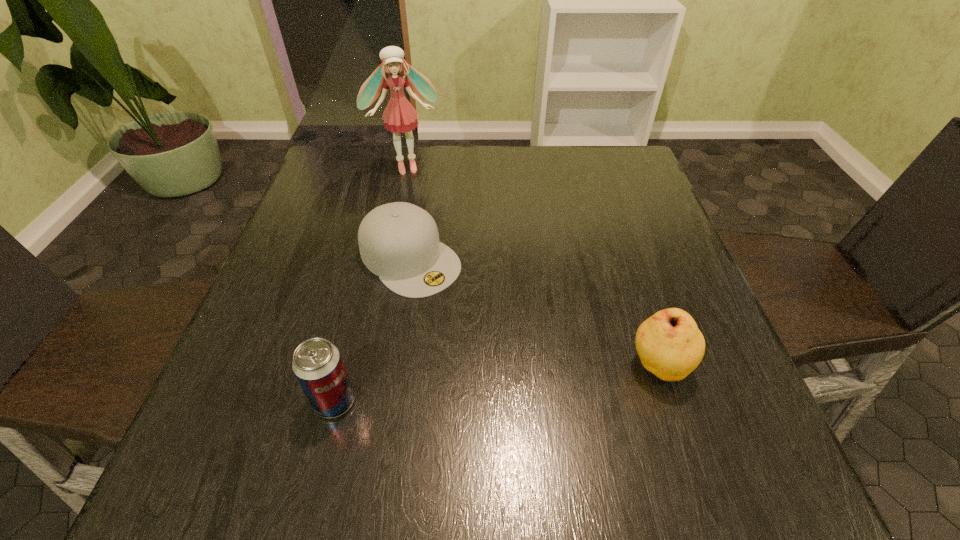
Where is `blank region between the rightmost object and the tallest object`? The image size is (960, 540). blank region between the rightmost object and the tallest object is located at coordinates (532, 267).

The width and height of the screenshot is (960, 540). I want to click on vacant area that lies between the pear and the farthest object, so click(x=532, y=267).

You are a GUI agent. You are given a task and a screenshot of the screen. Output one action in this format:
    pyautogui.click(x=<x>, y=<y>)
    Task: Click on the empty space between the tallest object and the pear
    Image resolution: width=960 pixels, height=540 pixels.
    Given the screenshot: What is the action you would take?
    pyautogui.click(x=532, y=267)

Locate an element on the screen. The height and width of the screenshot is (540, 960). vacant space in between the tallest object and the pear is located at coordinates [532, 267].

The height and width of the screenshot is (540, 960). Identify the location of free space between the rightmost object and the doll. (532, 267).

Locate an element on the screen. vacant region between the second farthest object and the pear is located at coordinates (535, 312).

You are a GUI agent. You are given a task and a screenshot of the screen. Output one action in this format:
    pyautogui.click(x=<x>, y=<y>)
    Task: Click on the object that is the third closest to the second farthest object
    
    Given the screenshot: What is the action you would take?
    pyautogui.click(x=670, y=345)

Locate which object ranks third in proximity to the beer can. Please provide its 2D coordinates. Your answer should be formatted as a tuple, i.e. [(x, y)], where the tuple contains the x and y coordinates of a point satisfying the conditions above.

[(399, 116)]

Locate an element on the screen. Image resolution: width=960 pixels, height=540 pixels. free location that satisfies the following two spatial constraints: 1. on the front side of the third nearest object; 2. on the left side of the farthest object is located at coordinates (385, 259).

At what (x,y) coordinates should I click in order to perform the action: click on free space that satisfies the following two spatial constraints: 1. on the front side of the doll; 2. on the right side of the third nearest object. Please return your answer as a coordinate pair (x, y). The width and height of the screenshot is (960, 540). Looking at the image, I should click on (385, 259).